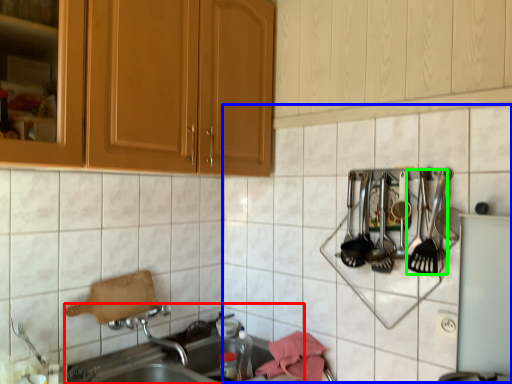
Question: Considering the real-world distances, which object is closest to sink (highlighted by a red box)? tile (highlighted by a blue box) or silverware (highlighted by a green box).

Choices:
 (A) tile
 (B) silverware

Answer: (A)